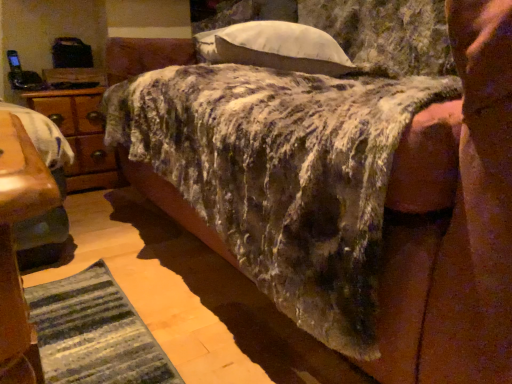
Question: Based on their positions, is fuzzy fabric mattress at center located to the left or right of white soft pillow at upper center?

Choices:
 (A) right
 (B) left

Answer: (A)

Question: Is point (240, 142) closer or farther from the camera than point (269, 21)?

Choices:
 (A) farther
 (B) closer

Answer: (B)

Question: Which object is the closest to the white soft pillow at upper center?

Choices:
 (A) wooden nightstand at left
 (B) fuzzy fabric mattress at center

Answer: (B)

Question: Which object is positioned closest to the fuzzy fabric mattress at center?

Choices:
 (A) wooden nightstand at left
 (B) white soft pillow at upper center

Answer: (B)